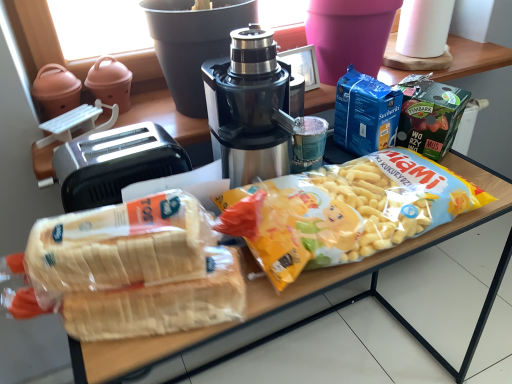
Question: Considering the relative sizes of stainless steel coffee maker at center and translucent plastic bread at lower left in the image provided, is stainless steel coffee maker at center shorter than translucent plastic bread at lower left?

Choices:
 (A) no
 (B) yes

Answer: (A)

Question: Can you confirm if stainless steel coffee maker at center is thinner than translucent plastic bread at lower left?

Choices:
 (A) no
 (B) yes

Answer: (A)

Question: From a real-world perspective, is stainless steel coffee maker at center positioned under translucent plastic bread at lower left based on gravity?

Choices:
 (A) no
 (B) yes

Answer: (A)

Question: Is stainless steel coffee maker at center at the right side of translucent plastic bread at lower left?

Choices:
 (A) yes
 (B) no

Answer: (A)

Question: Does stainless steel coffee maker at center come in front of translucent plastic bread at lower left?

Choices:
 (A) no
 (B) yes

Answer: (A)

Question: Is white paper towel at upper right situated inside translucent plastic bag of bread at center or outside?

Choices:
 (A) inside
 (B) outside

Answer: (B)

Question: Is white paper towel at upper right bigger or smaller than translucent plastic bag of bread at center?

Choices:
 (A) small
 (B) big

Answer: (A)

Question: From a real-world perspective, is white paper towel at upper right above or below translucent plastic bag of bread at center?

Choices:
 (A) above
 (B) below

Answer: (A)

Question: From the image's perspective, is white paper towel at upper right located above or below translucent plastic bag of bread at center?

Choices:
 (A) above
 (B) below

Answer: (A)

Question: Is stainless steel coffee maker at center situated inside translucent plastic bag of bread at center or outside?

Choices:
 (A) inside
 (B) outside

Answer: (B)

Question: Based on their sizes in the image, would you say stainless steel coffee maker at center is bigger or smaller than translucent plastic bag of bread at center?

Choices:
 (A) big
 (B) small

Answer: (B)

Question: Visually, is stainless steel coffee maker at center positioned to the left or to the right of translucent plastic bag of bread at center?

Choices:
 (A) right
 (B) left

Answer: (B)

Question: From a real-world perspective, is stainless steel coffee maker at center physically located above or below translucent plastic bag of bread at center?

Choices:
 (A) below
 (B) above

Answer: (B)

Question: Is stainless steel coffee maker at center spatially inside translucent plastic bread at lower left, or outside of it?

Choices:
 (A) inside
 (B) outside

Answer: (B)

Question: Is stainless steel coffee maker at center in front of or behind translucent plastic bread at lower left in the image?

Choices:
 (A) behind
 (B) front

Answer: (A)